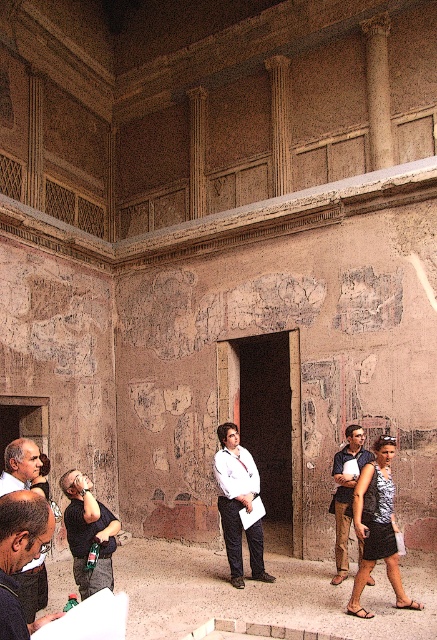
Question: Which point is closer to the camera?

Choices:
 (A) (346, 476)
 (B) (97, 573)
 (C) (366, 465)
 (D) (252, 497)

Answer: (B)

Question: Is white shirt at center thinner than dark gray suit at lower left?

Choices:
 (A) yes
 (B) no

Answer: (B)

Question: Which point is closer to the camera?

Choices:
 (A) (364, 468)
 (B) (27, 609)
 (C) (107, 541)
 (D) (344, 486)

Answer: (B)

Question: Does dark gray shirt at center have a greater width compared to dark gray suit at lower left?

Choices:
 (A) yes
 (B) no

Answer: (A)

Question: Where is white shirt at center located in relation to dark gray suit at lower left in the image?

Choices:
 (A) left
 (B) right

Answer: (B)

Question: Estimate the real-world distances between objects in this image. Which object is closer to the dark gray shirt at center?

Choices:
 (A) brown leather pants at lower right
 (B) dark gray suit at lower left
 (C) white shirt at center

Answer: (B)